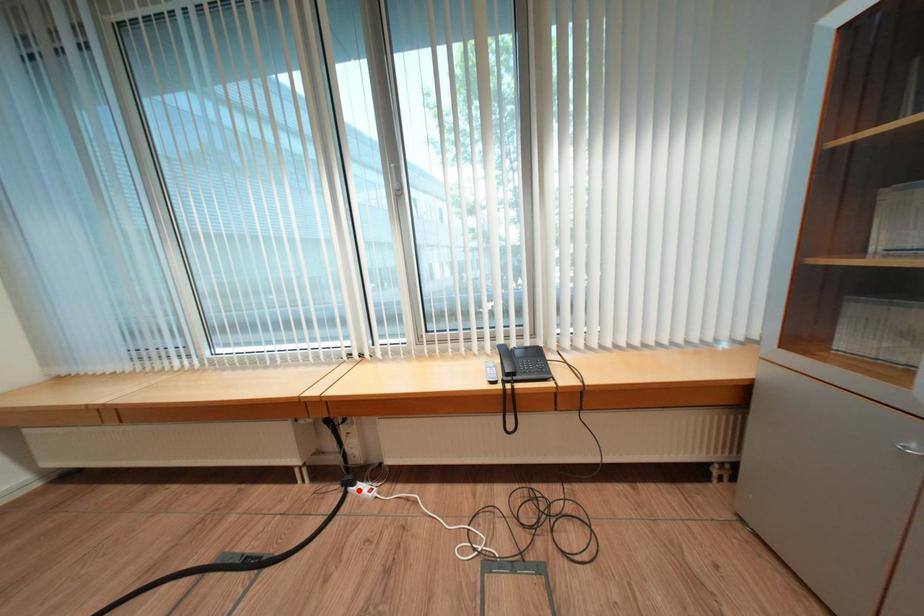
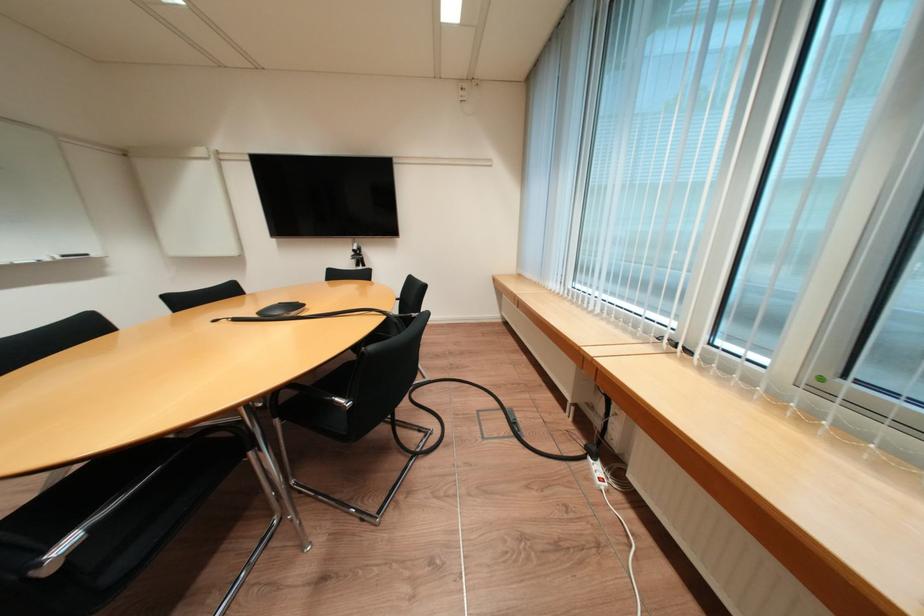
Find the pixel in the second image that matches the highlighted location in the first image.

(598, 459)